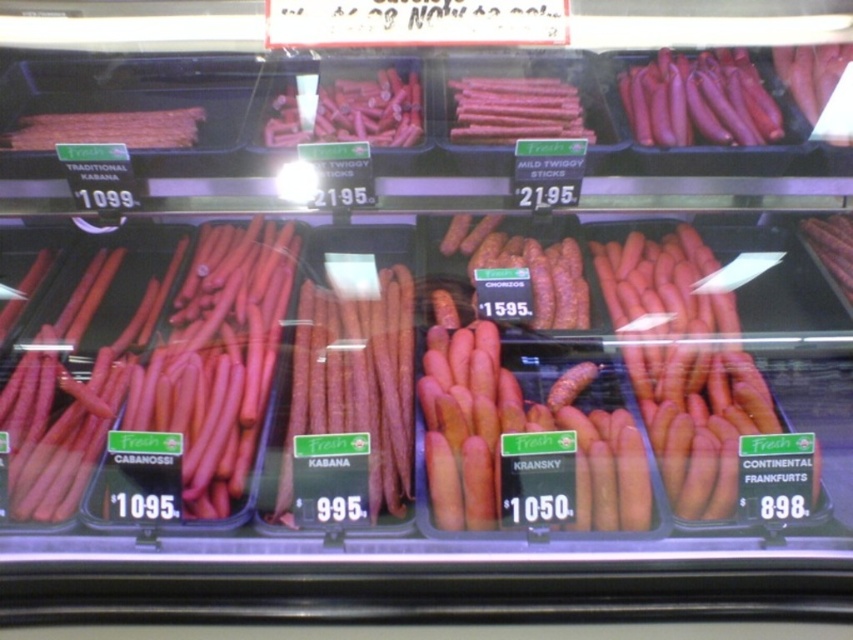
Question: Considering the relative positions of pink glossy sausages at upper right and matte brown kabanossi at upper left in the image provided, where is pink glossy sausages at upper right located with respect to matte brown kabanossi at upper left?

Choices:
 (A) left
 (B) right

Answer: (B)

Question: Estimate the real-world distances between objects in this image. Which object is closer to the smooth pink stick at center?

Choices:
 (A) pink glossy sausages at upper right
 (B) matte brown kabanossi at upper left

Answer: (A)

Question: Which object is closer to the camera taking this photo?

Choices:
 (A) smooth pink stick at center
 (B) matte pink stick at center
 (C) matte brown kabanossi at upper left

Answer: (A)

Question: Is pink glossy sausages at upper right above smooth pink stick at center?

Choices:
 (A) no
 (B) yes

Answer: (B)

Question: Which point is farther from the camera taking this photo?

Choices:
 (A) (573, 122)
 (B) (289, 88)

Answer: (B)

Question: Does smooth pink stick at center appear on the left side of matte brown kabanossi at upper left?

Choices:
 (A) no
 (B) yes

Answer: (A)